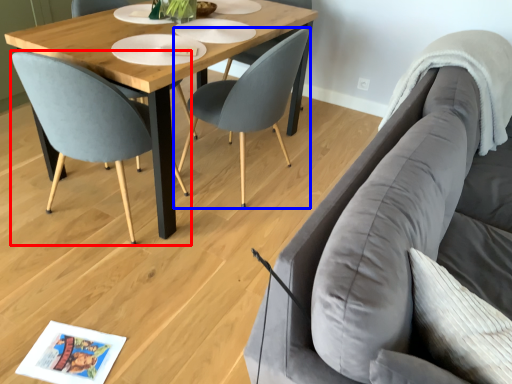
Question: Which point is closer to the camera, chair (highlighted by a red box) or chair (highlighted by a blue box)?

Choices:
 (A) chair
 (B) chair

Answer: (A)